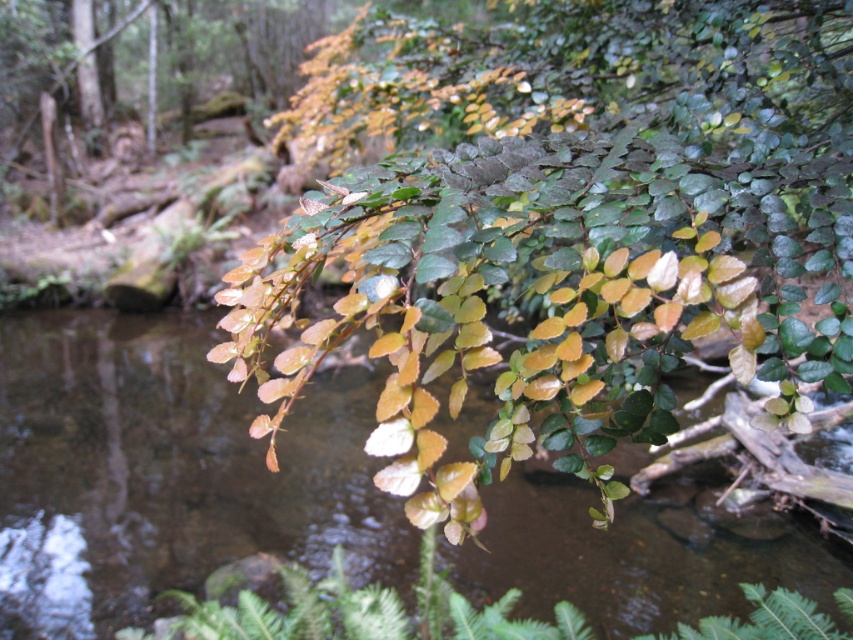
Question: Does green glossy leaves at upper center come in front of green leafy branch at center?

Choices:
 (A) no
 (B) yes

Answer: (B)

Question: Which of the following is the closest to the observer?

Choices:
 (A) green glossy leaves at upper center
 (B) green leafy branch at center

Answer: (A)

Question: Which point appears closest to the camera in this image?

Choices:
 (A) (380, 90)
 (B) (114, 595)

Answer: (A)

Question: Which point is closer to the camera taking this photo?

Choices:
 (A) (51, 468)
 (B) (456, 150)

Answer: (B)

Question: Does green glossy leaves at upper center appear on the right side of green leafy branch at center?

Choices:
 (A) no
 (B) yes

Answer: (A)

Question: Does green glossy leaves at upper center appear under green leafy branch at center?

Choices:
 (A) no
 (B) yes

Answer: (A)